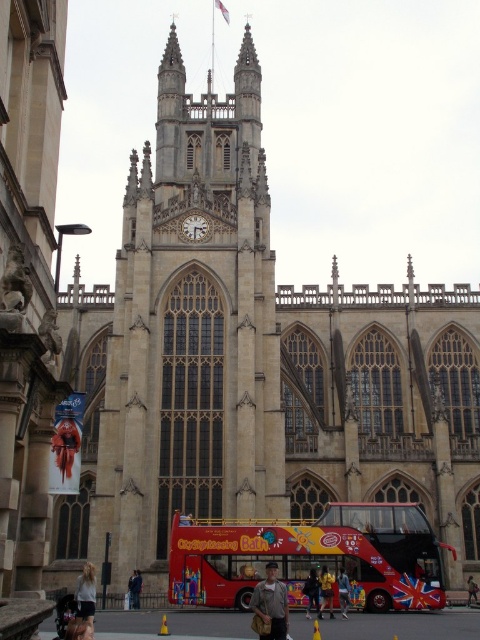
This screenshot has height=640, width=480. Describe the element at coordinates (325, 592) in the screenshot. I see `yellow fabric bag at center` at that location.

Is point (326, 596) less distant than point (314, 579)?

That is True.

This screenshot has height=640, width=480. In order to click on yellow fabric bag at center in this screenshot , I will do `click(325, 592)`.

Is light brown hair at lower left below blue denim jacket at center?

Incorrect, light brown hair at lower left is not positioned below blue denim jacket at center.

This screenshot has width=480, height=640. Describe the element at coordinates (85, 595) in the screenshot. I see `light brown hair at lower left` at that location.

Does point (79, 602) lie in front of point (139, 570)?

That is True.

At what (x,y) coordinates should I click in order to perform the action: click on light brown hair at lower left. Please return your answer as a coordinate pair (x, y). Image resolution: width=480 pixels, height=640 pixels. Looking at the image, I should click on (85, 595).

Is point (149, 468) more distant than point (88, 577)?

Yes.

Identify the location of light brown stone tower at center. The height and width of the screenshot is (640, 480). (192, 328).